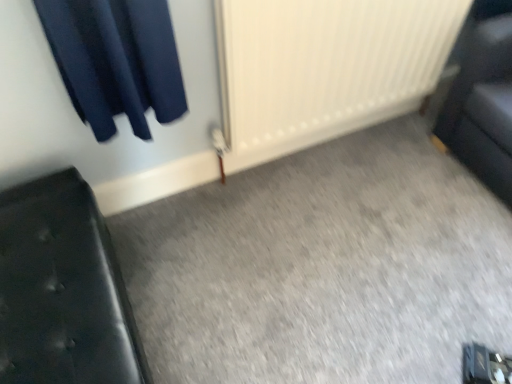
I want to click on white textured radiator at center, so click(325, 68).

The image size is (512, 384). Describe the element at coordinates (325, 68) in the screenshot. I see `white textured radiator at center` at that location.

What is the approximate width of white textured radiator at center?

white textured radiator at center is 6.93 inches in width.

Identify the location of black leather couch at left. This screenshot has width=512, height=384. (63, 290).

What do you see at coordinates (63, 290) in the screenshot? I see `black leather couch at left` at bounding box center [63, 290].

Identify the location of white textured radiator at center. The image size is (512, 384). (325, 68).

Is black leather couch at left to the right of white textured radiator at center from the viewer's perspective?

No.

Is black leather couch at left in front of white textured radiator at center?

Yes, it is.

Is point (113, 254) positioned after point (364, 38)?

No, (113, 254) is closer to viewer.

From the image's perspective, is black leather couch at left located above white textured radiator at center?

No, from the image's perspective, black leather couch at left is not over white textured radiator at center.

From a real-world perspective, is black leather couch at left above or below white textured radiator at center?

Clearly, from a real-world perspective, black leather couch at left is below white textured radiator at center.

Looking at this image, which of these two, black leather couch at left or white textured radiator at center, is thinner?

With smaller width is white textured radiator at center.

Which of these two, black leather couch at left or white textured radiator at center, stands taller?

white textured radiator at center is taller.

Based on their sizes in the image, would you say black leather couch at left is bigger or smaller than white textured radiator at center?

In the image, black leather couch at left appears to be smaller than white textured radiator at center.

Is black leather couch at left completely or partially outside of white textured radiator at center?

black leather couch at left is positioned outside white textured radiator at center.

Is black leather couch at left not near white textured radiator at center?

black leather couch at left is actually quite close to white textured radiator at center.

Is white textured radiator at center at the back of black leather couch at left?

black leather couch at left is not turned away from white textured radiator at center.

How different are the orientations of black leather couch at left and white textured radiator at center in degrees?

The angular difference between black leather couch at left and white textured radiator at center is 92 degrees.

Identify the location of furniture below the white textured radiator at center (from the image's perspective). (63, 290).

Is white textured radiator at center to the right of black leather couch at left from the viewer's perspective?

Indeed, white textured radiator at center is positioned on the right side of black leather couch at left.

Between white textured radiator at center and black leather couch at left, which one is positioned in front?

Positioned in front is black leather couch at left.

Considering the positions of points (325, 38) and (85, 294), is point (325, 38) closer to camera compared to point (85, 294)?

No.

From the image's perspective, between white textured radiator at center and black leather couch at left, which one is located above?

From the image's view, white textured radiator at center is above.

From a real-world perspective, who is located higher, white textured radiator at center or black leather couch at left?

From a 3D spatial view, white textured radiator at center is above.

Can you confirm if white textured radiator at center is thinner than black leather couch at left?

Yes, white textured radiator at center is thinner than black leather couch at left.

Who is shorter, white textured radiator at center or black leather couch at left?

With less height is black leather couch at left.

Consider the image. Is white textured radiator at center smaller than black leather couch at left?

No, white textured radiator at center is not smaller than black leather couch at left.

Is white textured radiator at center inside or outside of black leather couch at left?

white textured radiator at center is located beyond the bounds of black leather couch at left.

Is white textured radiator at center in contact with black leather couch at left?

No, white textured radiator at center is not beside black leather couch at left.

Does white textured radiator at center turn towards black leather couch at left?

No, white textured radiator at center is not facing towards black leather couch at left.

How far apart are white textured radiator at center and black leather couch at left?

white textured radiator at center is 33.01 inches from black leather couch at left.

The image size is (512, 384). I want to click on furniture on the left of white textured radiator at center, so click(x=63, y=290).

Locate an element on the screen. Image resolution: width=512 pixels, height=384 pixels. furniture below the white textured radiator at center (from a real-world perspective) is located at coordinates click(63, 290).

The height and width of the screenshot is (384, 512). What are the coordinates of `furniture below the white textured radiator at center (from the image's perspective)` in the screenshot? It's located at (63, 290).